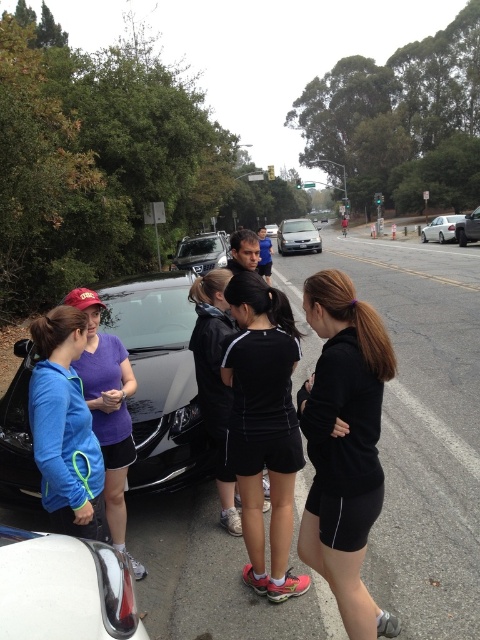
You are a pedestrian standing on the road and see the silver metallic sedan at center and the black matte car at center. Which car is taller?

The silver metallic sedan at center is much taller than the black matte car at center.